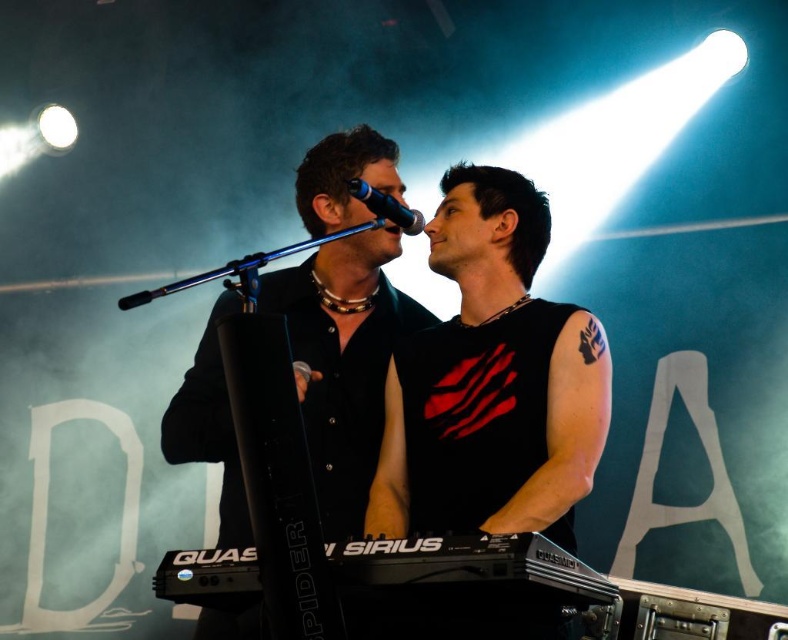
Question: Can you confirm if black matte tank top at center is positioned to the right of black matte shirt at center?

Choices:
 (A) yes
 (B) no

Answer: (A)

Question: Is black matte shirt at center bigger than black plastic keyboard at lower center?

Choices:
 (A) yes
 (B) no

Answer: (A)

Question: Which point appears closest to the camera in this image?

Choices:
 (A) (511, 570)
 (B) (403, 333)
 (C) (487, 417)

Answer: (A)

Question: Can you confirm if black matte shirt at center is positioned below black metallic microphone at upper center?

Choices:
 (A) yes
 (B) no

Answer: (A)

Question: Which point is farther from the camera taking this photo?

Choices:
 (A) (406, 554)
 (B) (374, 220)

Answer: (B)

Question: Which point is closer to the camera taking this photo?

Choices:
 (A) [x=388, y=195]
 (B) [x=545, y=588]
 (C) [x=511, y=483]

Answer: (B)